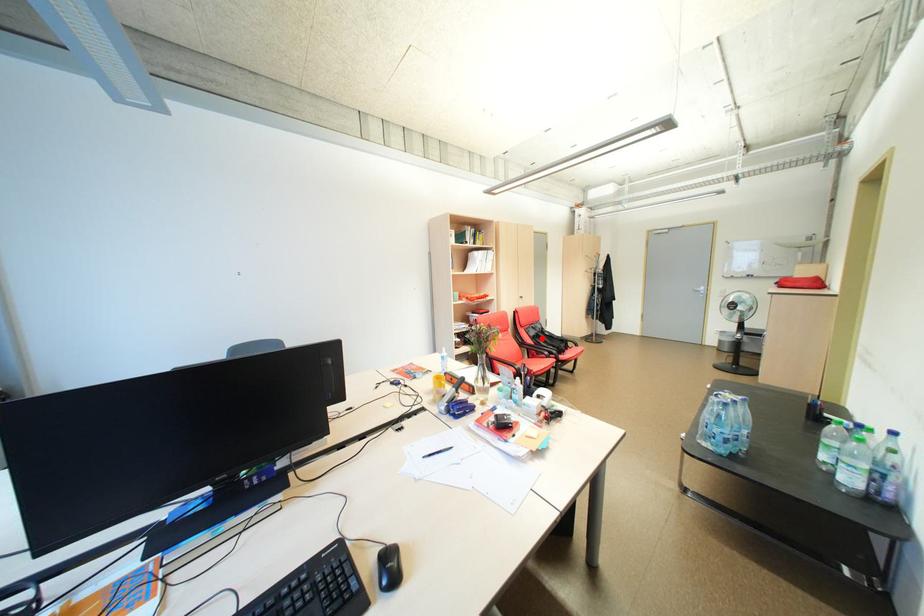
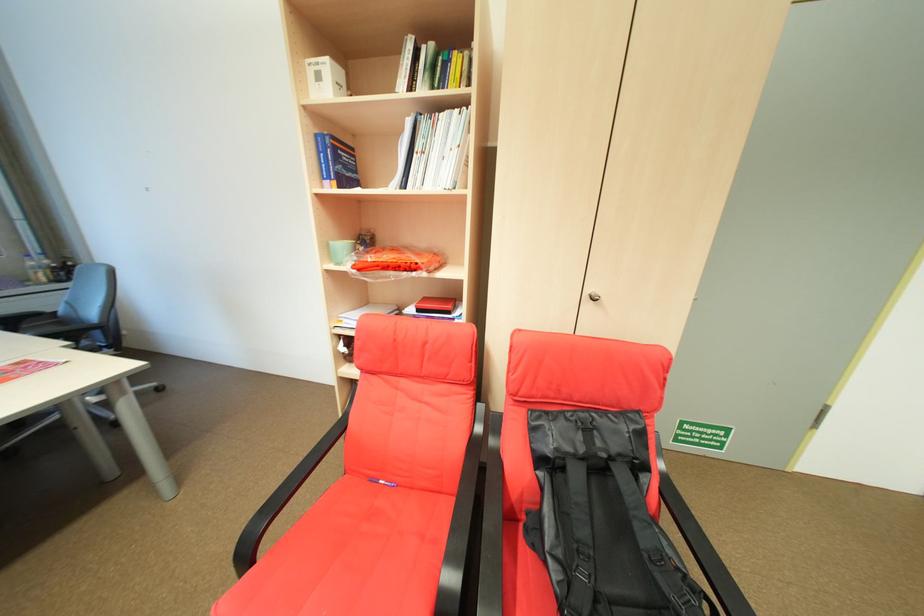
Question: A red point is marked in image1. In image2, is the corresponding 3D point closer to the camera or farther? Reply with the corresponding letter.

Choices:
 (A) The corresponding 3D point is closer.
 (B) The corresponding 3D point is farther.

Answer: (A)